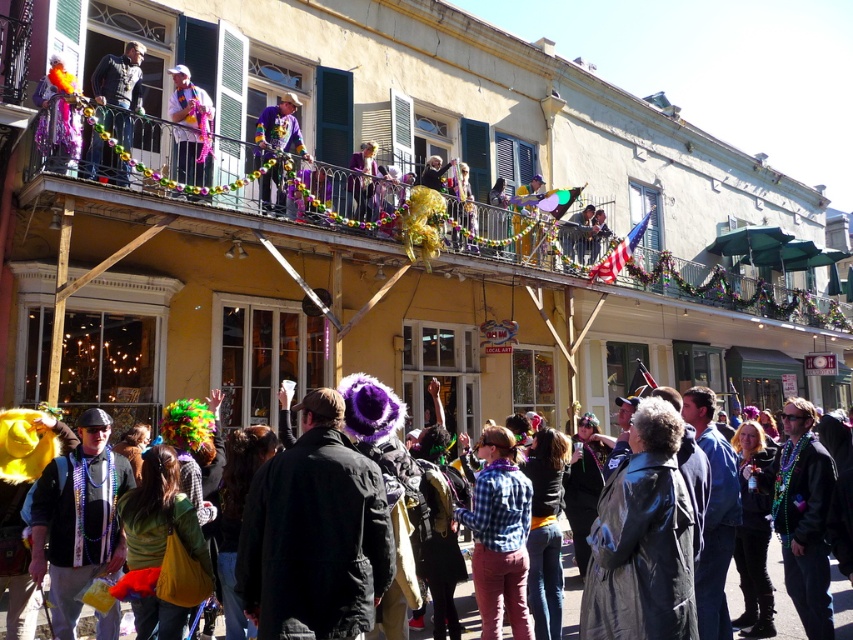
You are a photographer trying to capture both the matte black jacket at lower left and the matte black jacket at upper left in a single shot. Which jacket should you position your camera closer to in order to include both in the frame?

You should position your camera closer to the matte black jacket at lower left because it is to the right of the matte black jacket at upper left, allowing both to be captured in the frame by adjusting the angle.

Consider the image. You are a photographer capturing the festive scene. You want to ensure both the shiny orange feathers at upper left and the matte purple coat at upper center are in frame. Based on their positions, which object is positioned to the left of the other?

The shiny orange feathers at upper left are to the left of the matte purple coat at upper center.